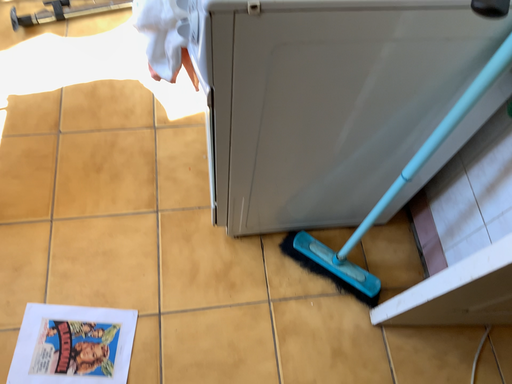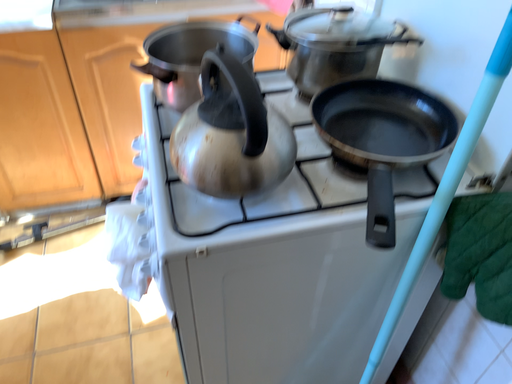
Question: Which way did the camera rotate in the video?

Choices:
 (A) rotated downward
 (B) rotated upward

Answer: (B)